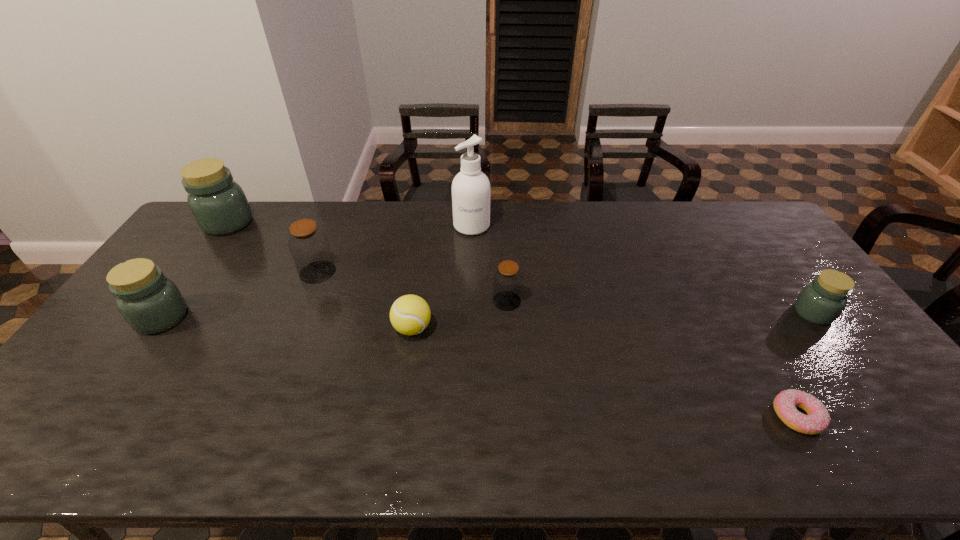
Where is `vacant region at the right edge of the desktop`? This screenshot has height=540, width=960. vacant region at the right edge of the desktop is located at coordinates tap(887, 386).

The height and width of the screenshot is (540, 960). I want to click on vacant area between the bigger brown jar and the smaller brown jar, so click(412, 287).

Where is `blank region between the farthest jar and the second farthest jar`? Image resolution: width=960 pixels, height=540 pixels. blank region between the farthest jar and the second farthest jar is located at coordinates (273, 247).

In order to click on vacant space that's between the second smallest green jar and the pink doughnut in this screenshot , I will do `click(480, 367)`.

I want to click on vacant point located between the seventh object from left to right and the farthest jar, so click(513, 320).

Identify the location of free space between the farthest green jar and the seventh object from left to right. (513, 320).

Identify the location of vacant area between the biggest green jar and the rightmost object. The height and width of the screenshot is (540, 960). (520, 268).

Where is `vacant region between the smaller brown jar and the third jar from right to left`? This screenshot has height=540, width=960. vacant region between the smaller brown jar and the third jar from right to left is located at coordinates (412, 287).

You are a GUI agent. You are given a task and a screenshot of the screen. Output one action in this format:
    pyautogui.click(x=<x>, y=<y>)
    Task: Click on the free space between the second object from right to left and the cleansing agent
    The image size is (960, 540).
    Given the screenshot: What is the action you would take?
    pyautogui.click(x=635, y=321)

The width and height of the screenshot is (960, 540). In order to click on unoccupied area between the smallest green jar and the tallest object in this screenshot , I will do `click(642, 269)`.